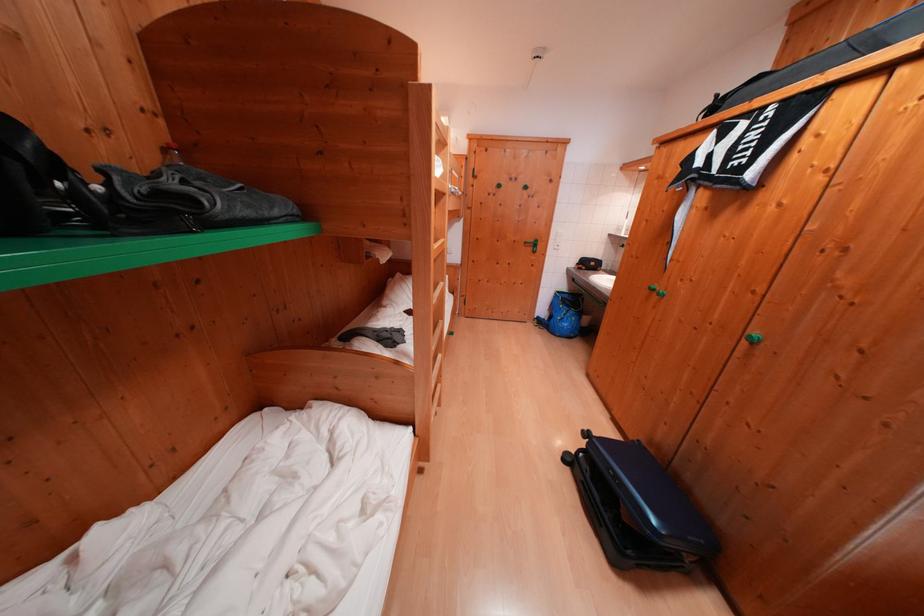
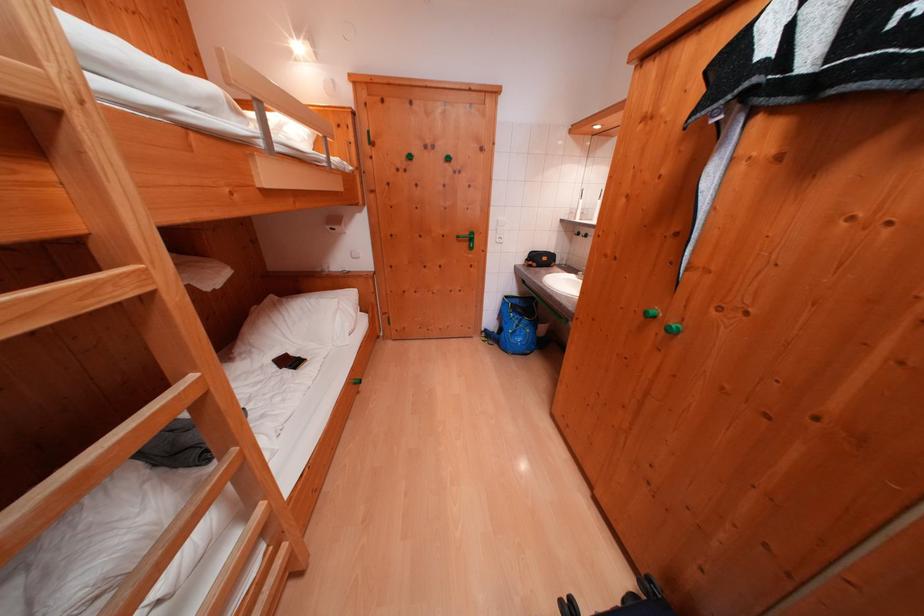
In the second image, find the point that corresponds to (565,296) in the first image.

(515, 301)